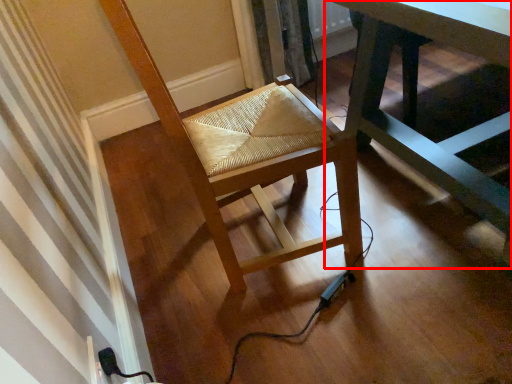
Question: From the image's perspective, where is table (annotated by the red box) located relative to chair?

Choices:
 (A) below
 (B) above

Answer: (B)